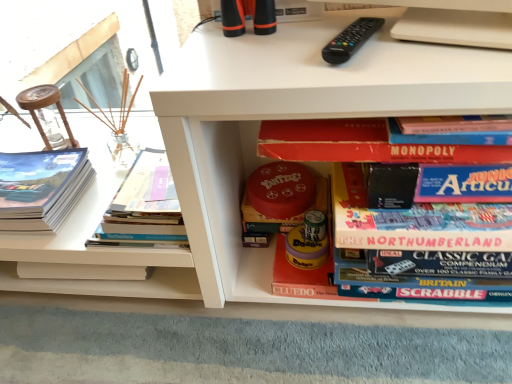
What is the approximate height of black plastic remote at upper center?

black plastic remote at upper center is 1.57 inches in height.

Measure the distance between red matte board game at center, the 4th book viewed from the left, and camera.

red matte board game at center, the 4th book viewed from the left, is 24.25 inches from camera.

The image size is (512, 384). In order to click on red matte board game at center, which is counted as the first book, starting from the right in this screenshot , I will do `click(357, 151)`.

This screenshot has height=384, width=512. What do you see at coordinates (282, 197) in the screenshot?
I see `red matte yahtzee board game at center, acting as the 2th book starting from the right` at bounding box center [282, 197].

Where is `matte paper book at left, which ranks as the fourth book in right-to-left order`? The image size is (512, 384). matte paper book at left, which ranks as the fourth book in right-to-left order is located at coordinates (41, 188).

Which of these two, hardcover book at left, the 3th book in the right-to-left sequence, or matte paper book at left, positioned as the 1th book in left-to-right order, is thinner?

Thinner between the two is matte paper book at left, positioned as the 1th book in left-to-right order.

From the image's perspective, which one is positioned higher, hardcover book at left, which appears as the second book when viewed from the left, or matte paper book at left, positioned as the 1th book in left-to-right order?

hardcover book at left, which appears as the second book when viewed from the left, is shown above in the image.

Which object is positioned more to the left, hardcover book at left, which appears as the second book when viewed from the left, or matte paper book at left, which ranks as the fourth book in right-to-left order?

matte paper book at left, which ranks as the fourth book in right-to-left order, is more to the left.

What's the angular difference between hardcover book at left, which appears as the second book when viewed from the left, and matte paper book at left, positioned as the 1th book in left-to-right order,'s facing directions?

They differ by 0.000907 degrees in their facing directions.

Does black plastic remote at upper center turn towards hardcover book at left, which appears as the second book when viewed from the left?

No, black plastic remote at upper center is not facing towards hardcover book at left, which appears as the second book when viewed from the left.

Is black plastic remote at upper center situated inside hardcover book at left, which appears as the second book when viewed from the left, or outside?

black plastic remote at upper center is outside hardcover book at left, which appears as the second book when viewed from the left.

Can you tell me how much black plastic remote at upper center and hardcover book at left, the 3th book in the right-to-left sequence, differ in facing direction?

The angle between the facing direction of black plastic remote at upper center and the facing direction of hardcover book at left, the 3th book in the right-to-left sequence, is 21.5 degrees.

In the image, is black plastic remote at upper center on the left side or the right side of hardcover book at left, the 3th book in the right-to-left sequence?

black plastic remote at upper center is positioned on hardcover book at left, the 3th book in the right-to-left sequence,'s right side.

Which object is more forward, hardcover book at left, which appears as the second book when viewed from the left, or red matte yahtzee board game at center, the third book from the left?

hardcover book at left, which appears as the second book when viewed from the left, is closer to the camera.

Is hardcover book at left, which appears as the second book when viewed from the left, looking in the opposite direction of red matte yahtzee board game at center, the third book from the left?

No.

Considering the relative sizes of hardcover book at left, which appears as the second book when viewed from the left, and red matte yahtzee board game at center, acting as the 2th book starting from the right, in the image provided, is hardcover book at left, which appears as the second book when viewed from the left, shorter than red matte yahtzee board game at center, acting as the 2th book starting from the right,?

Correct, hardcover book at left, which appears as the second book when viewed from the left, is not as tall as red matte yahtzee board game at center, acting as the 2th book starting from the right.

Is black plastic remote at upper center to the right of matte paper book at left, positioned as the 1th book in left-to-right order, from the viewer's perspective?

Indeed, black plastic remote at upper center is positioned on the right side of matte paper book at left, positioned as the 1th book in left-to-right order.

Is black plastic remote at upper center outside of matte paper book at left, which ranks as the fourth book in right-to-left order?

black plastic remote at upper center is positioned outside matte paper book at left, which ranks as the fourth book in right-to-left order.

From the image's perspective, which object appears higher, black plastic remote at upper center or matte paper book at left, positioned as the 1th book in left-to-right order?

black plastic remote at upper center.

Does black plastic remote at upper center have a greater height compared to matte paper book at left, positioned as the 1th book in left-to-right order?

Incorrect, the height of black plastic remote at upper center is not larger of that of matte paper book at left, positioned as the 1th book in left-to-right order.

Can you confirm if red matte board game at center, which is counted as the first book, starting from the right, is positioned to the right of matte paper book at left, positioned as the 1th book in left-to-right order?

Yes.

Does red matte board game at center, the 4th book viewed from the left, have a lesser height compared to matte paper book at left, positioned as the 1th book in left-to-right order?

Incorrect, the height of red matte board game at center, the 4th book viewed from the left, does not fall short of that of matte paper book at left, positioned as the 1th book in left-to-right order.

Which object is more forward, red matte board game at center, the 4th book viewed from the left, or matte paper book at left, positioned as the 1th book in left-to-right order?

red matte board game at center, the 4th book viewed from the left, is closer to the camera.

Consider the image. Based on their sizes in the image, would you say red matte board game at center, which is counted as the first book, starting from the right, is bigger or smaller than matte paper book at left, which ranks as the fourth book in right-to-left order?

red matte board game at center, which is counted as the first book, starting from the right, is bigger than matte paper book at left, which ranks as the fourth book in right-to-left order.

Does red matte yahtzee board game at center, the third book from the left, turn towards black plastic remote at upper center?

No, red matte yahtzee board game at center, the third book from the left, is not turned towards black plastic remote at upper center.

Looking at this image, is red matte yahtzee board game at center, acting as the 2th book starting from the right, at the right side of black plastic remote at upper center?

No, red matte yahtzee board game at center, acting as the 2th book starting from the right, is not to the right of black plastic remote at upper center.

Considering the positions of objects matte paper book at left, positioned as the 1th book in left-to-right order, and hardcover book at left, which appears as the second book when viewed from the left, in the image provided, who is more to the right, matte paper book at left, positioned as the 1th book in left-to-right order, or hardcover book at left, which appears as the second book when viewed from the left,?

From the viewer's perspective, hardcover book at left, which appears as the second book when viewed from the left, appears more on the right side.

Considering the sizes of objects matte paper book at left, positioned as the 1th book in left-to-right order, and hardcover book at left, the 3th book in the right-to-left sequence, in the image provided, who is bigger, matte paper book at left, positioned as the 1th book in left-to-right order, or hardcover book at left, the 3th book in the right-to-left sequence,?

With larger size is matte paper book at left, positioned as the 1th book in left-to-right order.

How much distance is there between matte paper book at left, which ranks as the fourth book in right-to-left order, and hardcover book at left, the 3th book in the right-to-left sequence?

matte paper book at left, which ranks as the fourth book in right-to-left order, is 7.81 inches away from hardcover book at left, the 3th book in the right-to-left sequence.

From the image's perspective, is matte paper book at left, positioned as the 1th book in left-to-right order, located above hardcover book at left, which appears as the second book when viewed from the left?

No, from the image's perspective, matte paper book at left, positioned as the 1th book in left-to-right order, is not above hardcover book at left, which appears as the second book when viewed from the left.

From the hardcover book at left, which appears as the second book when viewed from the left, count 1st books backward and point to it. Please provide its 2D coordinates.

[(41, 188)]

Locate an element on the screen. The width and height of the screenshot is (512, 384). the 1st book positioned below the black plastic remote at upper center (from the image's perspective) is located at coordinates (144, 207).

Estimate the real-world distances between objects in this image. Which object is further from black plastic remote at upper center, red matte yahtzee board game at center, acting as the 2th book starting from the right, or hardcover book at left, the 3th book in the right-to-left sequence?

hardcover book at left, the 3th book in the right-to-left sequence, is further to black plastic remote at upper center.

Considering their positions, is matte paper book at left, which ranks as the fourth book in right-to-left order, positioned closer to red matte board game at center, the 4th book viewed from the left, than black plastic remote at upper center?

black plastic remote at upper center.

When comparing their distances from black plastic remote at upper center, does red matte yahtzee board game at center, the third book from the left, or matte paper book at left, positioned as the 1th book in left-to-right order, seem further?

Among the two, matte paper book at left, positioned as the 1th book in left-to-right order, is located further to black plastic remote at upper center.

From the image, which object appears to be farther from hardcover book at left, which appears as the second book when viewed from the left, black plastic remote at upper center or red matte yahtzee board game at center, acting as the 2th book starting from the right?

black plastic remote at upper center is further to hardcover book at left, which appears as the second book when viewed from the left.

Looking at the image, which one is located closer to red matte yahtzee board game at center, the third book from the left, hardcover book at left, which appears as the second book when viewed from the left, or matte paper book at left, which ranks as the fourth book in right-to-left order?

hardcover book at left, which appears as the second book when viewed from the left.

When comparing their distances from hardcover book at left, the 3th book in the right-to-left sequence, does red matte yahtzee board game at center, acting as the 2th book starting from the right, or red matte board game at center, which is counted as the first book, starting from the right, seem closer?

red matte yahtzee board game at center, acting as the 2th book starting from the right, lies closer to hardcover book at left, the 3th book in the right-to-left sequence, than the other object.

Looking at this image, considering their positions, is black plastic remote at upper center positioned further to matte paper book at left, positioned as the 1th book in left-to-right order, than red matte yahtzee board game at center, acting as the 2th book starting from the right?

black plastic remote at upper center is further to matte paper book at left, positioned as the 1th book in left-to-right order.

From the image, which object appears to be farther from red matte board game at center, which is counted as the first book, starting from the right, red matte yahtzee board game at center, the third book from the left, or black plastic remote at upper center?

red matte yahtzee board game at center, the third book from the left.

At what (x,y) coordinates should I click in order to perform the action: click on remote control located between red matte board game at center, the 4th book viewed from the left, and red matte yahtzee board game at center, acting as the 2th book starting from the right, in the depth direction. Please return your answer as a coordinate pair (x, y). Looking at the image, I should click on (350, 40).

Locate an element on the screen. Image resolution: width=512 pixels, height=384 pixels. book between matte paper book at left, which ranks as the fourth book in right-to-left order, and red matte yahtzee board game at center, the third book from the left, in the horizontal direction is located at coordinates (144, 207).

Locate an element on the screen. remote control between hardcover book at left, which appears as the second book when viewed from the left, and red matte board game at center, which is counted as the first book, starting from the right is located at coordinates (350, 40).

Find the location of a particular element. remote control between matte paper book at left, positioned as the 1th book in left-to-right order, and red matte board game at center, the 4th book viewed from the left, in the horizontal direction is located at coordinates (350, 40).